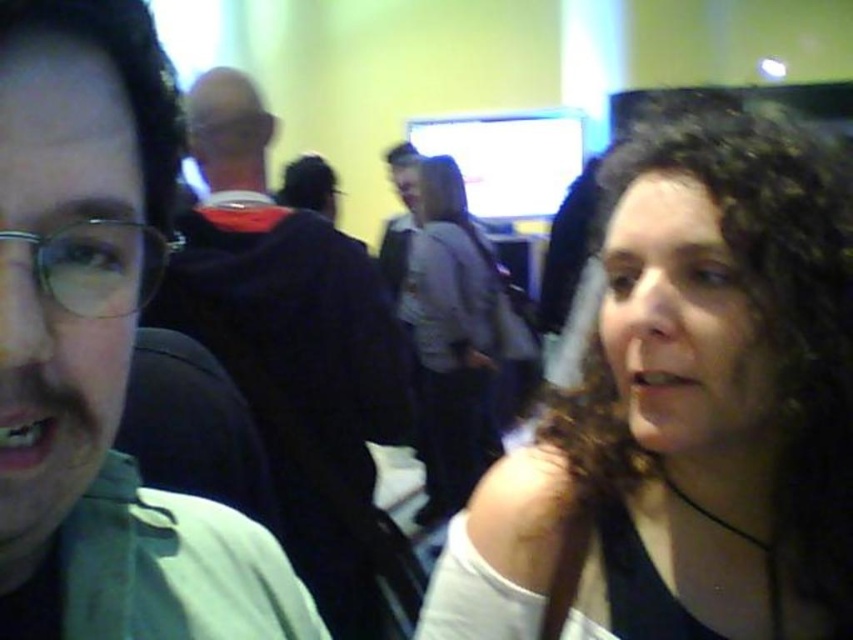
Is point (61, 305) farther from camera compared to point (204, 125)?

No, (61, 305) is in front of (204, 125).

Can you confirm if metallic frame glasses at left is bigger than matte black glasses at center?

No.

Where is `metallic frame glasses at left`? This screenshot has width=853, height=640. metallic frame glasses at left is located at coordinates (97, 266).

The width and height of the screenshot is (853, 640). In order to click on metallic frame glasses at left in this screenshot , I will do `click(97, 266)`.

Which is behind, point (793, 122) or point (53, 280)?

Positioned behind is point (793, 122).

The width and height of the screenshot is (853, 640). What do you see at coordinates (686, 412) in the screenshot?
I see `dark curly hair at upper right` at bounding box center [686, 412].

Image resolution: width=853 pixels, height=640 pixels. Identify the location of dark curly hair at upper right. click(x=686, y=412).

Who is lower down, dark blue jacket at center or gray fabric shirt at center?

dark blue jacket at center

Measure the distance between dark blue jacket at center and gray fabric shirt at center.

dark blue jacket at center and gray fabric shirt at center are 4.86 feet apart from each other.

What do you see at coordinates (302, 372) in the screenshot? The height and width of the screenshot is (640, 853). I see `dark blue jacket at center` at bounding box center [302, 372].

Locate an element on the screen. The width and height of the screenshot is (853, 640). dark blue jacket at center is located at coordinates (302, 372).